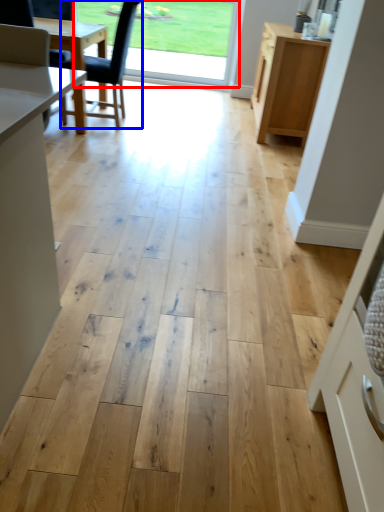
Question: Which of the following is the closest to the observer, window screen (highlighted by a red box) or chair (highlighted by a blue box)?

Choices:
 (A) window screen
 (B) chair

Answer: (B)